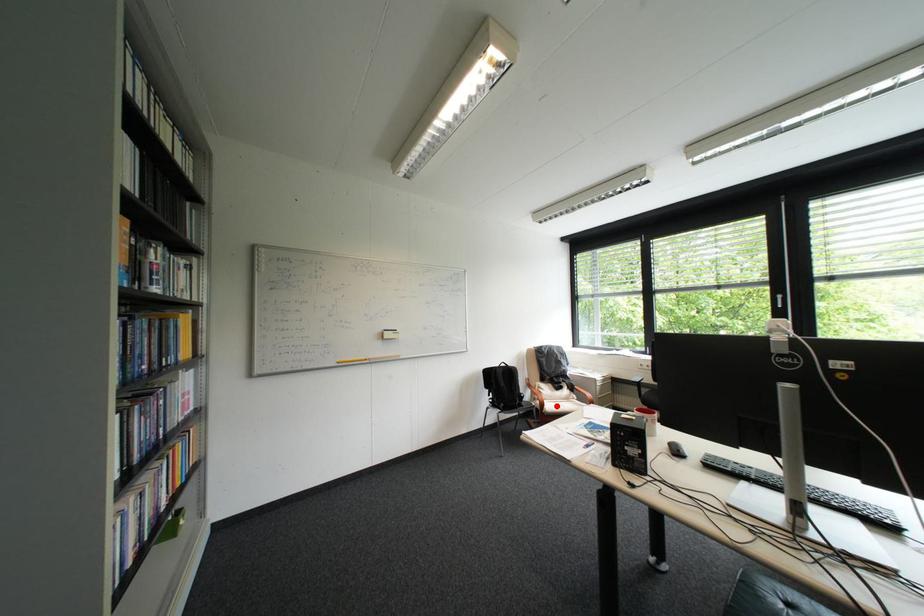
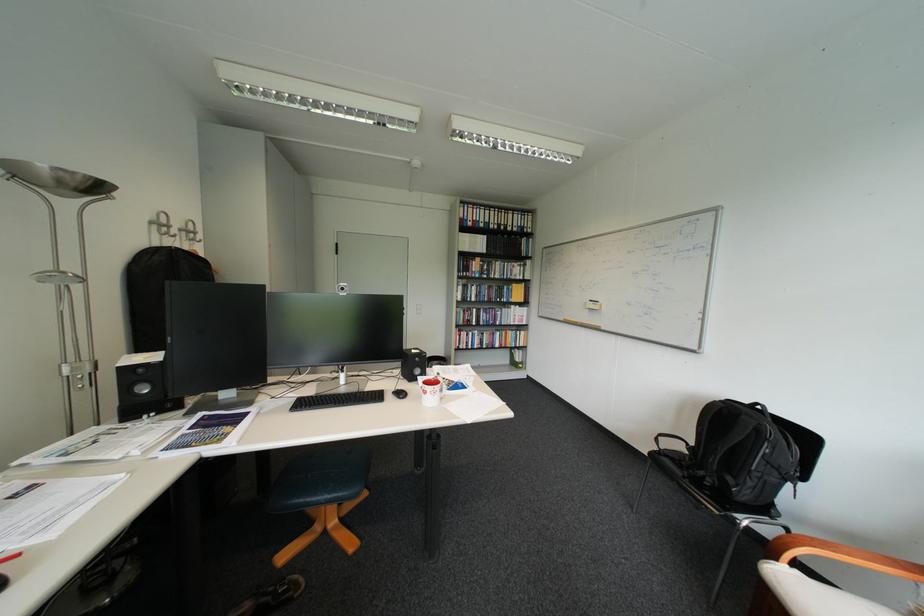
Question: I am providing you with two images of the same scene from different viewpoints. A red point is marked on the first image. Is the red point's position out of view in image 2?

Choices:
 (A) Yes
 (B) No

Answer: (B)